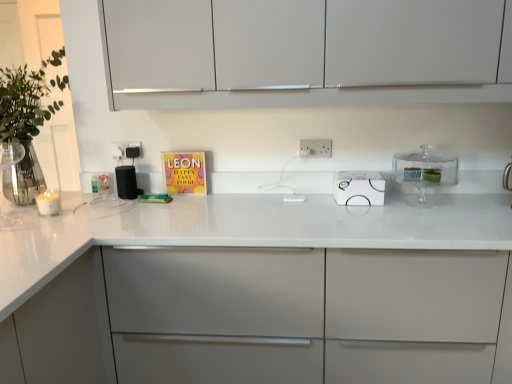
Measure the distance between clear glass cake stand at right and camera.

5.65 feet.

What do you see at coordinates (424, 171) in the screenshot?
I see `clear glass cake stand at right` at bounding box center [424, 171].

Locate an element on the screen. This screenshot has width=512, height=384. green leafy plant at left is located at coordinates (26, 123).

Locate an element on the screen. white plastic electric outlet at center, which is the first electric outlet in left-to-right order is located at coordinates (128, 149).

What are the coordinates of `white glossy electric stove at center` in the screenshot? It's located at (359, 188).

Identify the location of clear glass cake stand at right. (424, 171).

Considering the sizes of objects white matte cabinet at upper center, arranged as the first cabinetry when viewed from the top, and white glossy electric stove at center in the image provided, who is bigger, white matte cabinet at upper center, arranged as the first cabinetry when viewed from the top, or white glossy electric stove at center?

white matte cabinet at upper center, arranged as the first cabinetry when viewed from the top.

Are white matte cabinet at upper center, arranged as the first cabinetry when viewed from the top, and white glossy electric stove at center far apart?

They are positioned close to each other.

What's the angular difference between white matte cabinet at upper center, arranged as the first cabinetry when viewed from the top, and white glossy electric stove at center's facing directions?

They differ by 88.5 degrees in their facing directions.

From a real-world perspective, relative to white glossy electric stove at center, is white matte cabinet at upper center, arranged as the first cabinetry when viewed from the top, vertically above or below?

white matte cabinet at upper center, arranged as the first cabinetry when viewed from the top, is above white glossy electric stove at center.

Is green leafy plant at left outside of black matte speaker at center?

Indeed, green leafy plant at left is completely outside black matte speaker at center.

How many degrees apart are the facing directions of green leafy plant at left and black matte speaker at center?

The facing directions of green leafy plant at left and black matte speaker at center are 90 degrees apart.

Considering the relative sizes of green leafy plant at left and black matte speaker at center in the image provided, is green leafy plant at left bigger than black matte speaker at center?

Yes, green leafy plant at left is bigger than black matte speaker at center.

Between white glossy electric stove at center and matte colorful book at center, which one has smaller width?

matte colorful book at center.

Is white glossy electric stove at center turned away from matte colorful book at center?

white glossy electric stove at center is not turned away from matte colorful book at center.

Identify the location of book cover that appears behind the white glossy electric stove at center. Image resolution: width=512 pixels, height=384 pixels. (184, 172).

From the picture: From a real-world perspective, is white glossy electric stove at center above or below matte colorful book at center?

In terms of real-world spatial position, white glossy electric stove at center is below matte colorful book at center.

Which object is positioned more to the right, matte colorful book at center or black matte speaker at center?

Positioned to the right is matte colorful book at center.

Is matte colorful book at center bigger or smaller than black matte speaker at center?

matte colorful book at center is bigger than black matte speaker at center.

What's the angular difference between matte colorful book at center and black matte speaker at center's facing directions?

0.611 degrees separate the facing orientations of matte colorful book at center and black matte speaker at center.

Is the surface of matte colorful book at center in direct contact with black matte speaker at center?

No, matte colorful book at center is not making contact with black matte speaker at center.

Could you tell me if white plastic electric outlet at center, the 2th electric outlet when ordered from right to left, is facing white glossy electric stove at center?

No, white plastic electric outlet at center, the 2th electric outlet when ordered from right to left, is not oriented towards white glossy electric stove at center.

Which of these two, white plastic electric outlet at center, placed as the 1th electric outlet when sorted from back to front, or white glossy electric stove at center, stands shorter?

white plastic electric outlet at center, placed as the 1th electric outlet when sorted from back to front, is shorter.

Is white plastic electric outlet at center, the second electric outlet viewed from the front, smaller than white glossy electric stove at center?

Yes, white plastic electric outlet at center, the second electric outlet viewed from the front, is smaller than white glossy electric stove at center.

Does point (119, 159) come closer to viewer compared to point (372, 171)?

No, it is behind (372, 171).

Which object is positioned more to the left, clear glass cake stand at right or white glossy electric stove at center?

white glossy electric stove at center.

Is clear glass cake stand at right turned away from white glossy electric stove at center?

No, white glossy electric stove at center is not at the back of clear glass cake stand at right.

What's the angular difference between clear glass cake stand at right and white glossy electric stove at center's facing directions?

The angular difference between clear glass cake stand at right and white glossy electric stove at center is 0.316 degrees.

Does clear glass cake stand at right have a greater height compared to white glossy electric stove at center?

Correct, clear glass cake stand at right is much taller as white glossy electric stove at center.

Considering the sizes of objects black matte speaker at center and green leafy plant at left in the image provided, who is wider, black matte speaker at center or green leafy plant at left?

Wider between the two is green leafy plant at left.

From a real-world perspective, who is located lower, black matte speaker at center or green leafy plant at left?

In real-world perspective, black matte speaker at center is lower.

Does point (132, 179) come behind point (27, 123)?

Yes.

Where is `home appliance on the right of white matte cabinet at upper center, which is the 2th cabinetry from bottom to top`? home appliance on the right of white matte cabinet at upper center, which is the 2th cabinetry from bottom to top is located at coordinates (359, 188).

I want to click on plant located above the black matte speaker at center (from the image's perspective), so click(x=26, y=123).

Which object lies nearer to the anchor point white plastic electric outlet at center, which is the first electric outlet in left-to-right order, black matte speaker at center or white matte cabinet at center, which is counted as the 2th cabinetry, starting from the top?

Based on the image, black matte speaker at center appears to be nearer to white plastic electric outlet at center, which is the first electric outlet in left-to-right order.

Which object lies nearer to the anchor point clear glass cake stand at right, white matte cabinet at upper center, arranged as the first cabinetry when viewed from the top, or matte colorful book at center?

Among the two, white matte cabinet at upper center, arranged as the first cabinetry when viewed from the top, is located nearer to clear glass cake stand at right.

Based on their spatial positions, is matte colorful book at center or green leafy plant at left closer to white plastic electric outlet at center, which is the first electric outlet in left-to-right order?

matte colorful book at center lies closer to white plastic electric outlet at center, which is the first electric outlet in left-to-right order, than the other object.

Considering their positions, is white plastic electric outlet at center, which is the first electric outlet in left-to-right order, positioned closer to white matte cabinet at upper center, arranged as the first cabinetry when viewed from the top, than black matte speaker at center?

black matte speaker at center.

Based on their spatial positions, is white plastic electric outlet at center, marked as the 2th electric outlet in a back-to-front arrangement, or white matte cabinet at center, which is counted as the 2th cabinetry, starting from the top, closer to matte colorful book at center?

The object closer to matte colorful book at center is white plastic electric outlet at center, marked as the 2th electric outlet in a back-to-front arrangement.

Based on their spatial positions, is clear glass cake stand at right or green leafy plant at left closer to black matte speaker at center?

Among the two, green leafy plant at left is located nearer to black matte speaker at center.

Considering their positions, is white plastic electric outlet at center, the second electric outlet viewed from the front, positioned further to matte colorful book at center than black matte speaker at center?

white plastic electric outlet at center, the second electric outlet viewed from the front, is positioned further to the anchor matte colorful book at center.

Considering their positions, is white matte cabinet at upper center, arranged as the first cabinetry when viewed from the top, positioned further to clear glass cake stand at right than white plastic electric outlet at center, which is the first electric outlet in left-to-right order?

The object further to clear glass cake stand at right is white plastic electric outlet at center, which is the first electric outlet in left-to-right order.

Find the location of a particular element. appliance between green leafy plant at left and white glossy electric stove at center from left to right is located at coordinates (126, 182).

Image resolution: width=512 pixels, height=384 pixels. Identify the location of home appliance between white matte cabinet at center, which is counted as the 2th cabinetry, starting from the top, and clear glass cake stand at right. (359, 188).

Find the location of `home appliance between white plastic electric outlet at center, the 1th electric outlet when ordered from right to left, and white matte cabinet at center, which is counted as the 2th cabinetry, starting from the top, in the vertical direction`. home appliance between white plastic electric outlet at center, the 1th electric outlet when ordered from right to left, and white matte cabinet at center, which is counted as the 2th cabinetry, starting from the top, in the vertical direction is located at coordinates (359, 188).

Locate an element on the screen. cabinetry situated between green leafy plant at left and white matte cabinet at upper center, which is the 2th cabinetry from bottom to top, from left to right is located at coordinates (263, 317).